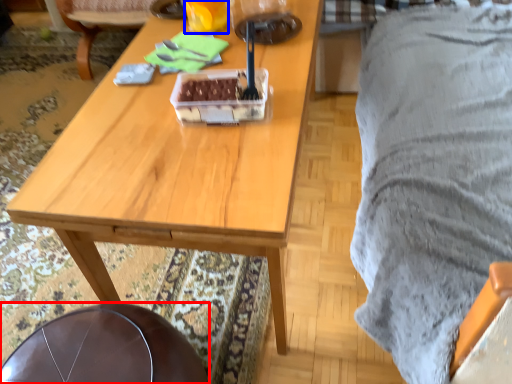
Question: Which point is further to the camera, chair (highlighted by a red box) or coffee cup (highlighted by a blue box)?

Choices:
 (A) chair
 (B) coffee cup

Answer: (B)